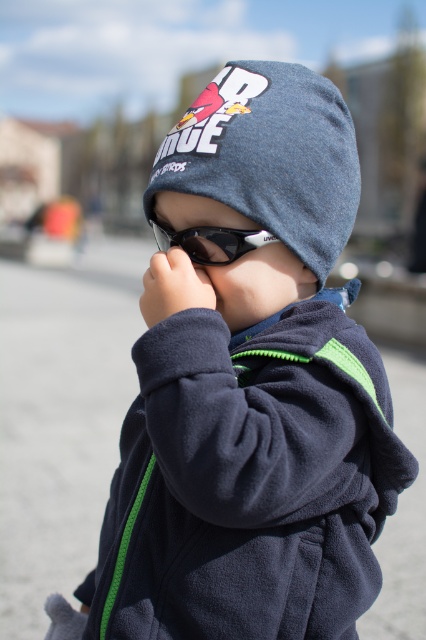
Can you confirm if dark gray fleece hand at center is positioned to the right of black plastic goggles at center?

In fact, dark gray fleece hand at center is to the left of black plastic goggles at center.

This screenshot has width=426, height=640. What do you see at coordinates (173, 285) in the screenshot?
I see `dark gray fleece hand at center` at bounding box center [173, 285].

I want to click on dark gray fleece hand at center, so click(173, 285).

Does denim knit beanie at center have a lesser width compared to black plastic goggles at center?

Incorrect, denim knit beanie at center's width is not less than black plastic goggles at center's.

Is point (226, 109) farther from viewer compared to point (219, 246)?

No, (226, 109) is closer to viewer.

Identify the location of denim knit beanie at center. (268, 156).

Is denim knit beanie at center thinner than dark gray fleece hand at center?

Incorrect, denim knit beanie at center's width is not less than dark gray fleece hand at center's.

Does denim knit beanie at center appear on the right side of dark gray fleece hand at center?

Yes, denim knit beanie at center is to the right of dark gray fleece hand at center.

The height and width of the screenshot is (640, 426). What do you see at coordinates (268, 156) in the screenshot? I see `denim knit beanie at center` at bounding box center [268, 156].

I want to click on denim knit beanie at center, so click(x=268, y=156).